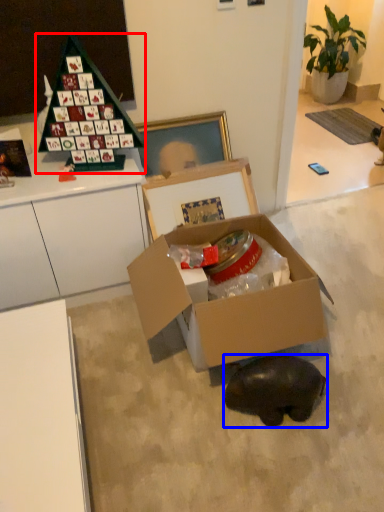
Question: Which of the following is the closest to the observer, toy (highlighted by a red box) or animal (highlighted by a blue box)?

Choices:
 (A) toy
 (B) animal

Answer: (B)